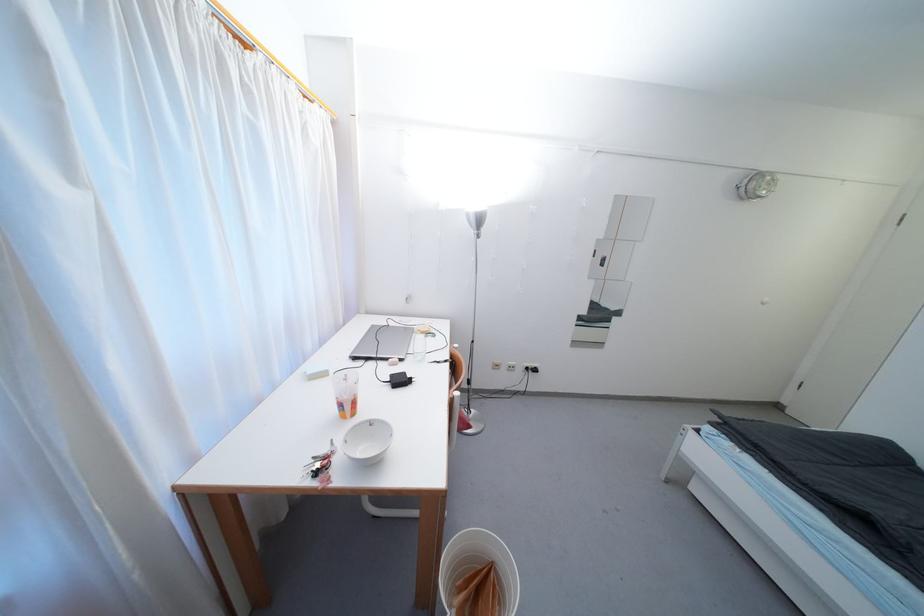
Find where to lift the black power adapter. Please return your answer as a coordinate pair (x, y).

(399, 379)